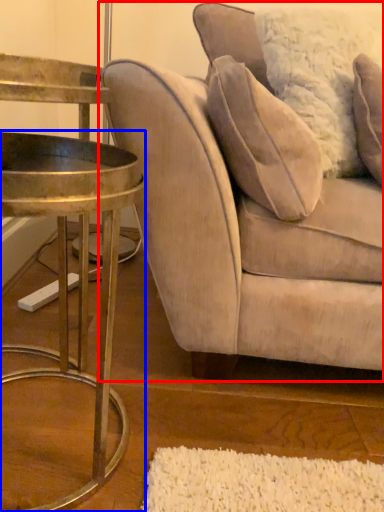
Question: Which point is closer to the camera, studio couch (highlighted by a red box) or table (highlighted by a blue box)?

Choices:
 (A) studio couch
 (B) table

Answer: (B)